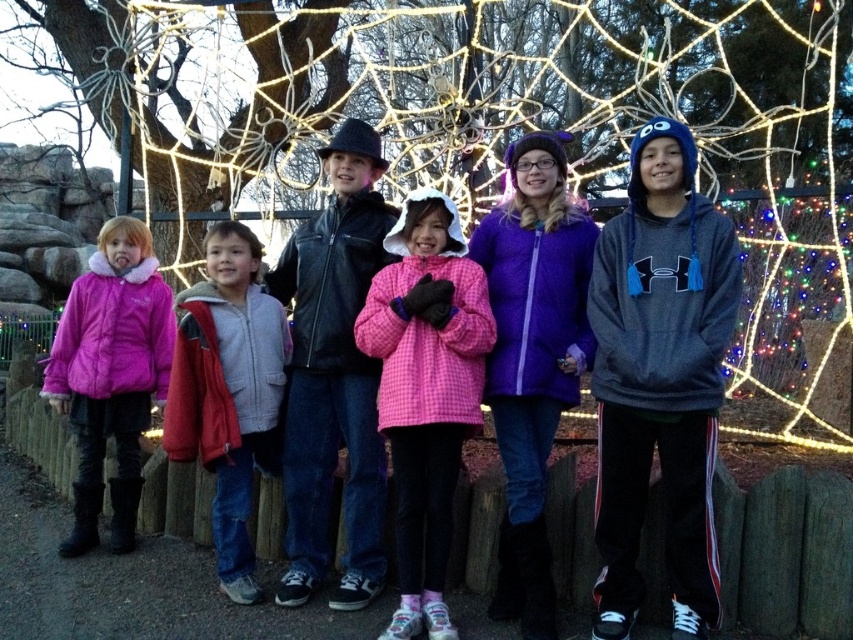
You are a photographer taking a picture of the children in front of the spider web backdrop. You notice two points marked in the scene. Which point is closer to the camera, point [299,237] or point [187,372]?

Point [299,237] is closer to the camera than point [187,372] because it is further to the viewer.